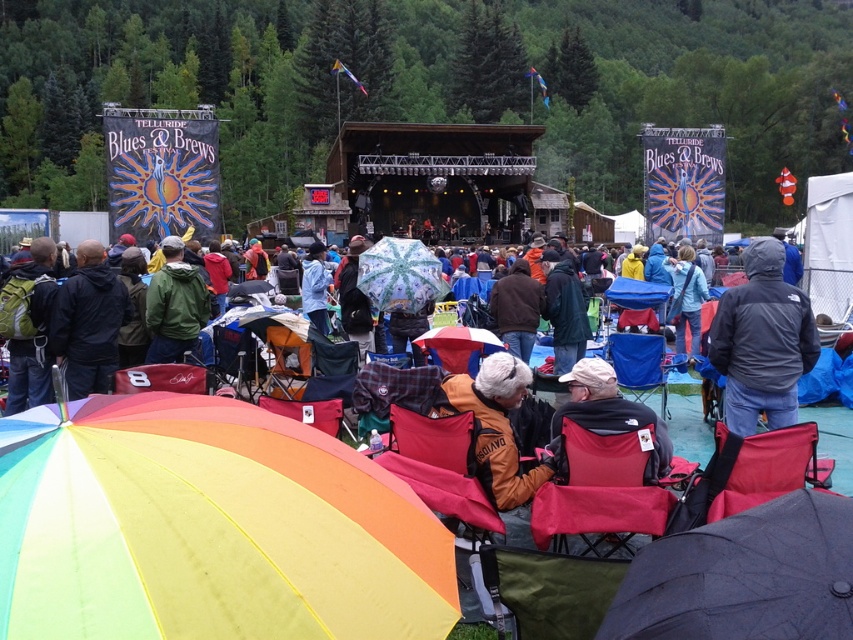
Question: Is green fabric chair at lower center further to the viewer compared to matte red folding chair at center?

Choices:
 (A) no
 (B) yes

Answer: (A)

Question: In this image, where is red fabric chair at center located relative to brown leather jacket at center?

Choices:
 (A) right
 (B) left

Answer: (A)

Question: Considering the real-world distances, which object is closest to the matte red folding chair at center?

Choices:
 (A) blue fabric chair at center
 (B) dark blue jacket at left
 (C) transparent floral-patterned umbrella at center
 (D) matte black backpack at left

Answer: (B)

Question: Can you confirm if brown leather jacket at center is positioned below blue fabric chair at center?

Choices:
 (A) no
 (B) yes

Answer: (A)

Question: Estimate the real-world distances between objects in this image. Which object is closer to the matte black backpack at left?

Choices:
 (A) dark green jacket at center
 (B) green fabric chair at lower center

Answer: (A)

Question: Which point appears farthest from the camera in this image?

Choices:
 (A) (102, 516)
 (B) (306, 253)
 (C) (190, 284)
 (D) (561, 273)

Answer: (B)